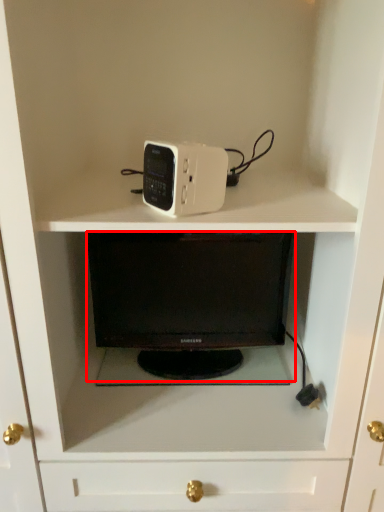
Question: Where is desktop (annotated by the red box) located in relation to home appliance in the image?

Choices:
 (A) right
 (B) left

Answer: (A)